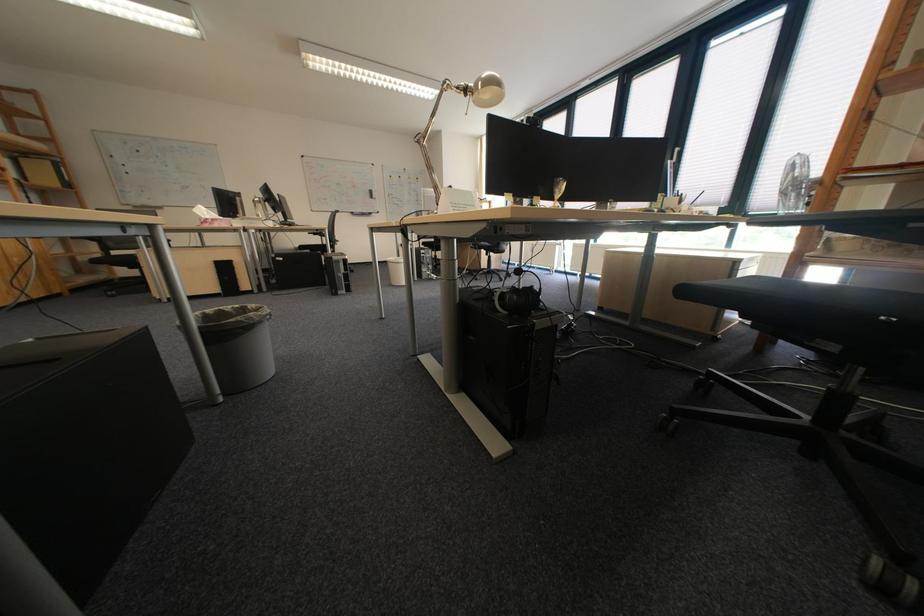
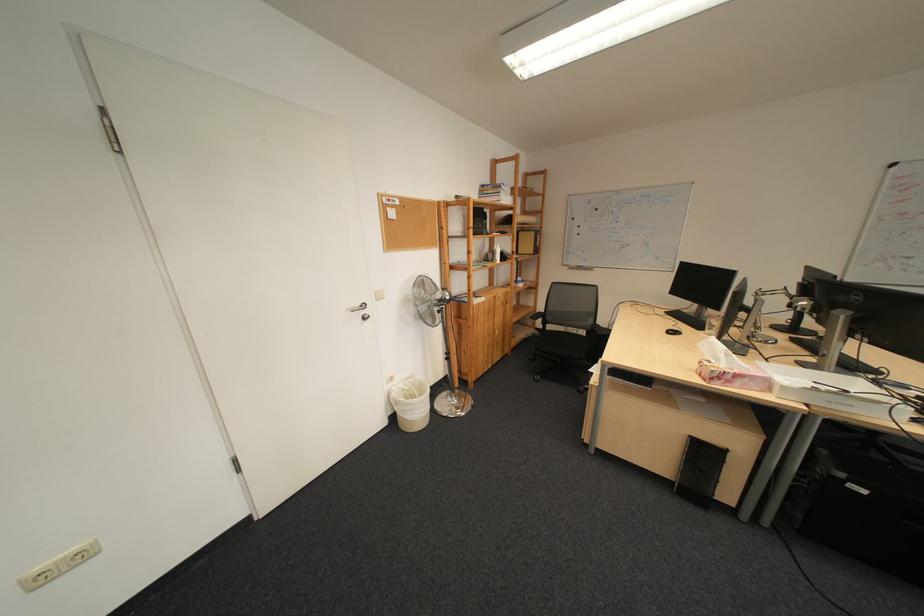
The point at [259,229] is marked in the first image. Where is the corresponding point in the second image?

(821, 407)